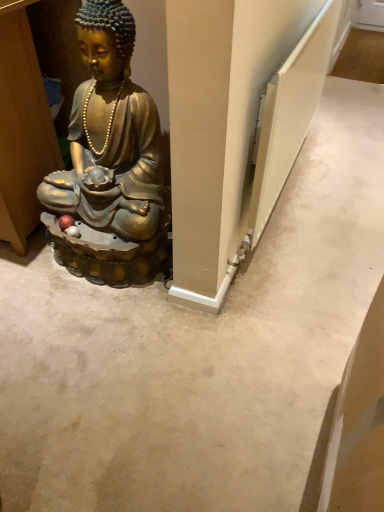
The width and height of the screenshot is (384, 512). I want to click on free point in front of gold metallic statue at left, so click(104, 339).